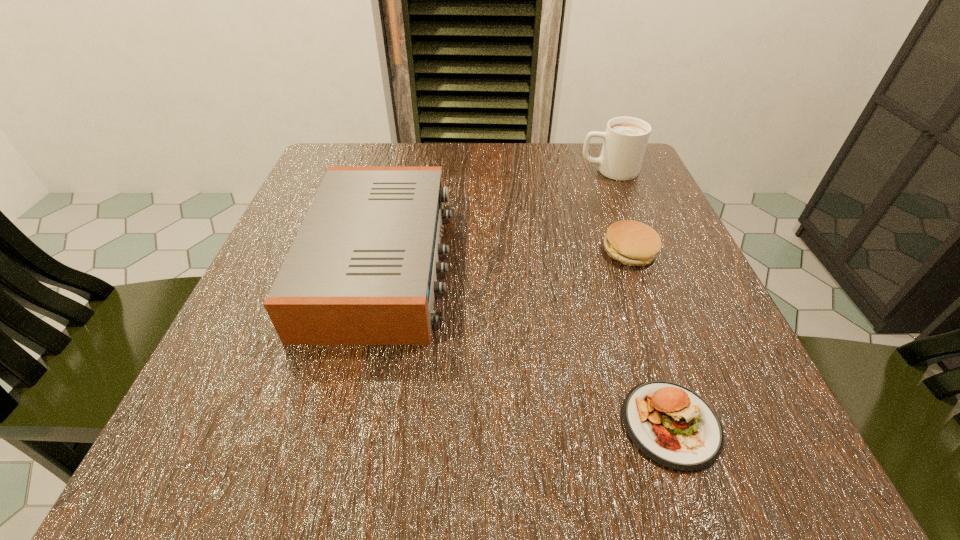
Locate an element on the screen. This screenshot has height=540, width=960. the tallest object is located at coordinates (625, 139).

Locate an element on the screen. The width and height of the screenshot is (960, 540). cappuccino is located at coordinates pyautogui.click(x=625, y=139).

Where is `the third shortest object`? This screenshot has width=960, height=540. the third shortest object is located at coordinates (362, 269).

The image size is (960, 540). I want to click on the leftmost object, so click(x=362, y=269).

Identify the location of the taller patty (food). The height and width of the screenshot is (540, 960). (631, 242).

The width and height of the screenshot is (960, 540). I want to click on the third tallest object, so click(631, 242).

Locate an element on the screen. The image size is (960, 540). the shortest object is located at coordinates (669, 423).

This screenshot has height=540, width=960. I want to click on the nearest object, so click(669, 423).

In order to click on blank space located 0.200m on the side with the handle of the cappuccino in this screenshot , I will do `click(490, 171)`.

Locate an element on the screen. blank area located 0.140m on the side with the handle of the cappuccino is located at coordinates click(x=516, y=171).